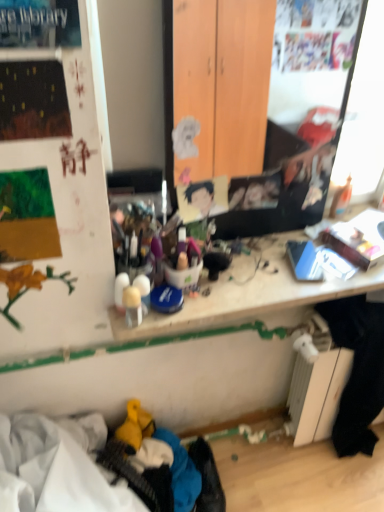
Question: From their relative heights in the image, would you say black fabric at lower right is taller or shorter than smooth cardboard portrait at center?

Choices:
 (A) tall
 (B) short

Answer: (A)

Question: Considering their positions, is black fabric at lower right located in front of or behind smooth cardboard portrait at center?

Choices:
 (A) behind
 (B) front

Answer: (A)

Question: Which is farther from the wooden desk at center?

Choices:
 (A) black fabric at lower right
 (B) smooth cardboard portrait at center

Answer: (A)

Question: Which is nearer to the wooden desk at center?

Choices:
 (A) smooth cardboard portrait at center
 (B) black fabric at lower right

Answer: (A)